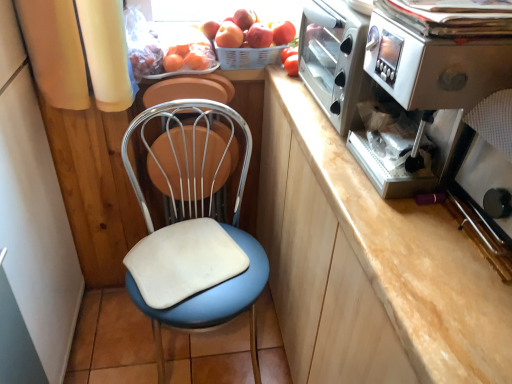
Question: Is point [x=404, y=57] positioned closer to the camera than point [x=247, y=41]?

Choices:
 (A) closer
 (B) farther

Answer: (A)

Question: Considering the positions of satin silver coffee machine at right and red matte apple at upper center, arranged as the second apple when viewed from the right, in the image, is satin silver coffee machine at right taller or shorter than red matte apple at upper center, arranged as the second apple when viewed from the right,?

Choices:
 (A) tall
 (B) short

Answer: (A)

Question: Estimate the real-world distances between objects in this image. Which object is closer to the red matte apple at upper center, placed as the 1th apple when sorted from right to left?

Choices:
 (A) plastic basket at upper center
 (B) white leatherette chair at center
 (C) smooth red apple at upper center, which is the first apple in left-to-right order
 (D) satin silver coffee machine at right
 (E) red matte tomato at upper right

Answer: (E)

Question: Which of these objects is positioned closest to the red matte apple at upper center, arranged as the 2th apple when viewed from the left?

Choices:
 (A) white leatherette chair at center
 (B) red matte tomato at upper right
 (C) red matte apple at upper center, placed as the 1th apple when sorted from right to left
 (D) smooth red apple at upper center, the 3th apple viewed from the right
 (E) satin silver coffee machine at right

Answer: (C)